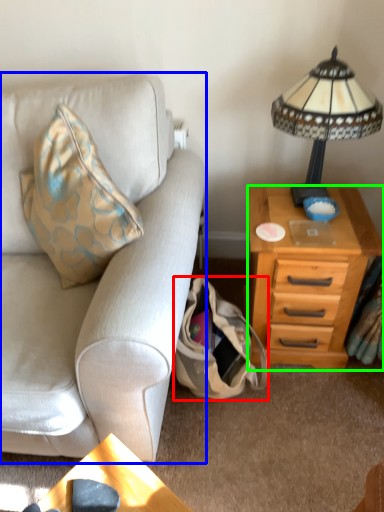
Question: Based on their relative distances, which object is nearer to handbag (highlighted by a red box)? Choose from studio couch (highlighted by a blue box) and nightstand (highlighted by a green box).

Choices:
 (A) studio couch
 (B) nightstand

Answer: (B)